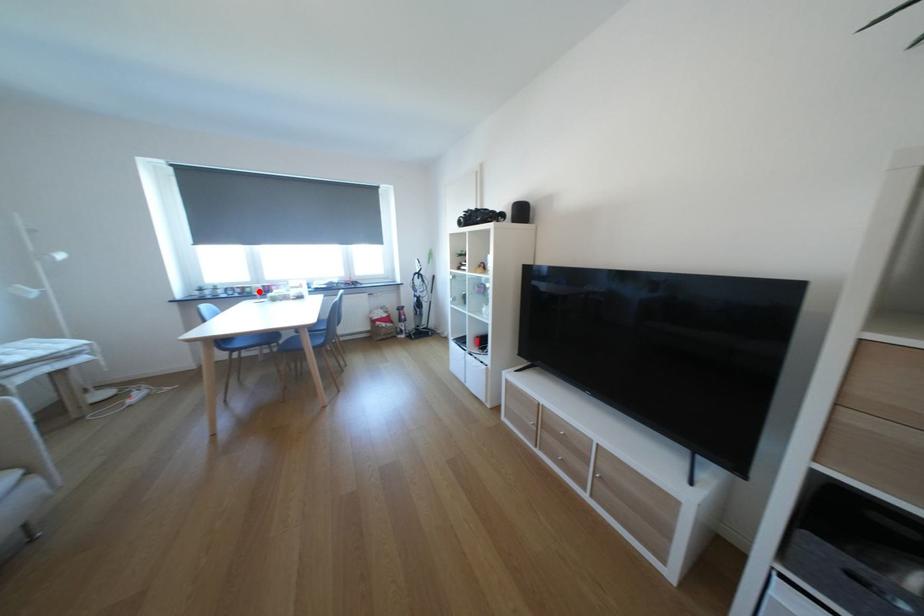
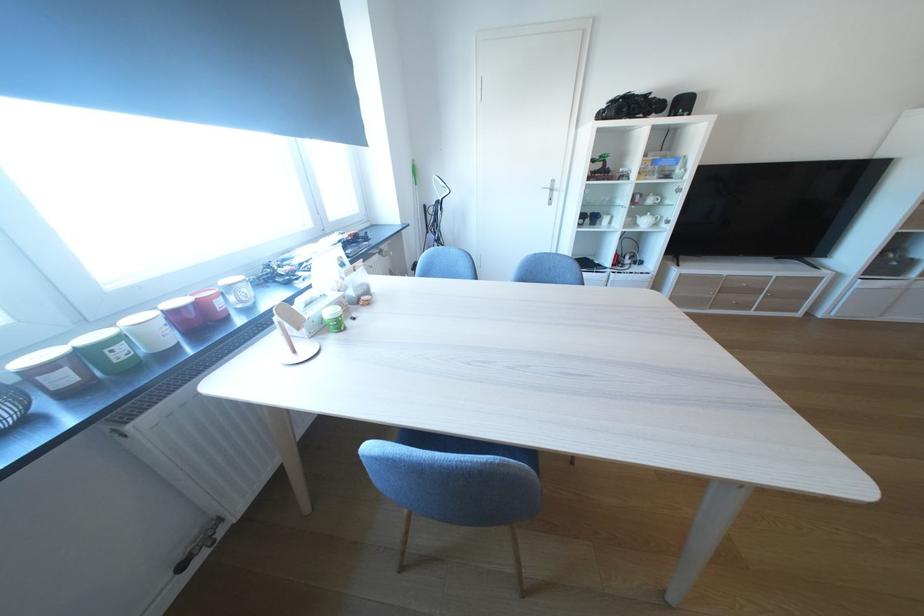
Find the pixel in the second image that matches the highlighted location in the first image.

(129, 354)